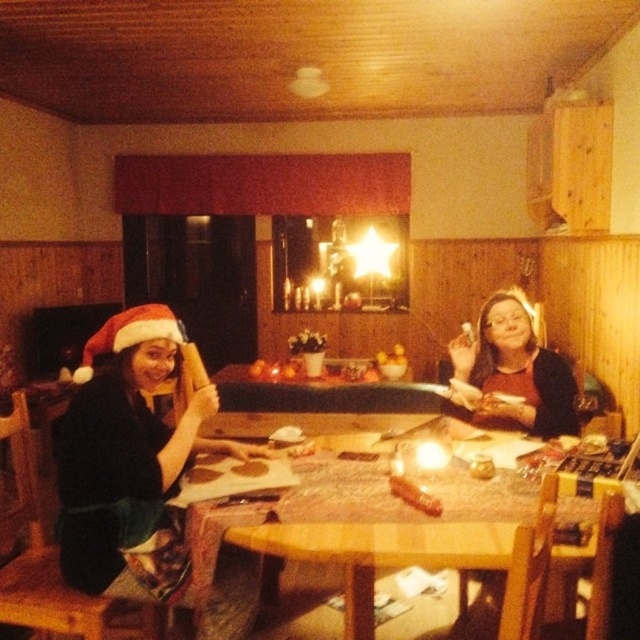
Who is positioned more to the left, matte black santa hat at left or wooden table at center?

Positioned to the left is matte black santa hat at left.

Is matte black santa hat at left thinner than wooden table at center?

Correct, matte black santa hat at left's width is less than wooden table at center's.

Image resolution: width=640 pixels, height=640 pixels. Find the location of `matte black santa hat at left`. matte black santa hat at left is located at coordinates (131, 458).

Which is in front, point (97, 563) or point (518, 429)?

Positioned in front is point (97, 563).

What do you see at coordinates (131, 458) in the screenshot? I see `matte black santa hat at left` at bounding box center [131, 458].

Which is in front, point (176, 481) or point (520, 330)?

Point (176, 481)

The height and width of the screenshot is (640, 640). Find the location of `matte black santa hat at left`. matte black santa hat at left is located at coordinates (131, 458).

Can you confirm if wooden table at center is positioned to the right of matte black sweater at center?

No, wooden table at center is not to the right of matte black sweater at center.

Does wooden table at center appear on the left side of matte black sweater at center?

Indeed, wooden table at center is positioned on the left side of matte black sweater at center.

Is point (349, 618) in front of point (547, 403)?

Yes, point (349, 618) is in front of point (547, 403).

Where is `wooden table at center`? wooden table at center is located at coordinates (284, 552).